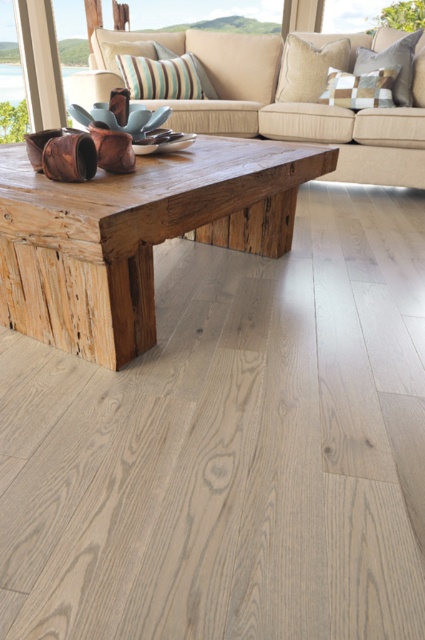
Question: Which point is closer to the camera?

Choices:
 (A) weathered wood coffee table at center
 (B) beige fabric couch at center

Answer: (A)

Question: Among these objects, which one is nearest to the camera?

Choices:
 (A) weathered wood coffee table at center
 (B) beige fabric couch at center

Answer: (A)

Question: Does weathered wood coffee table at center have a smaller size compared to beige fabric couch at center?

Choices:
 (A) yes
 (B) no

Answer: (A)

Question: Is weathered wood coffee table at center to the right of beige fabric couch at center from the viewer's perspective?

Choices:
 (A) yes
 (B) no

Answer: (B)

Question: Is weathered wood coffee table at center to the left of beige fabric couch at center from the viewer's perspective?

Choices:
 (A) yes
 (B) no

Answer: (A)